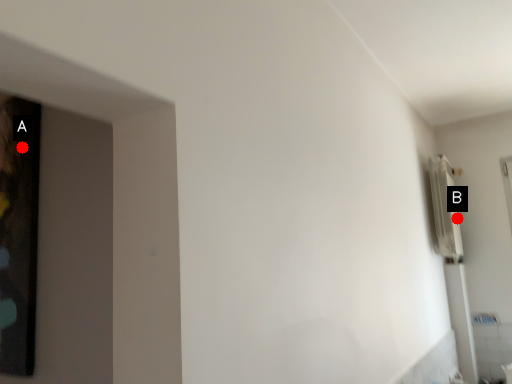
Question: Two points are circled on the image, labeled by A and B beside each circle. Which of the following is the closest to the observer?

Choices:
 (A) A is closer
 (B) B is closer

Answer: (A)